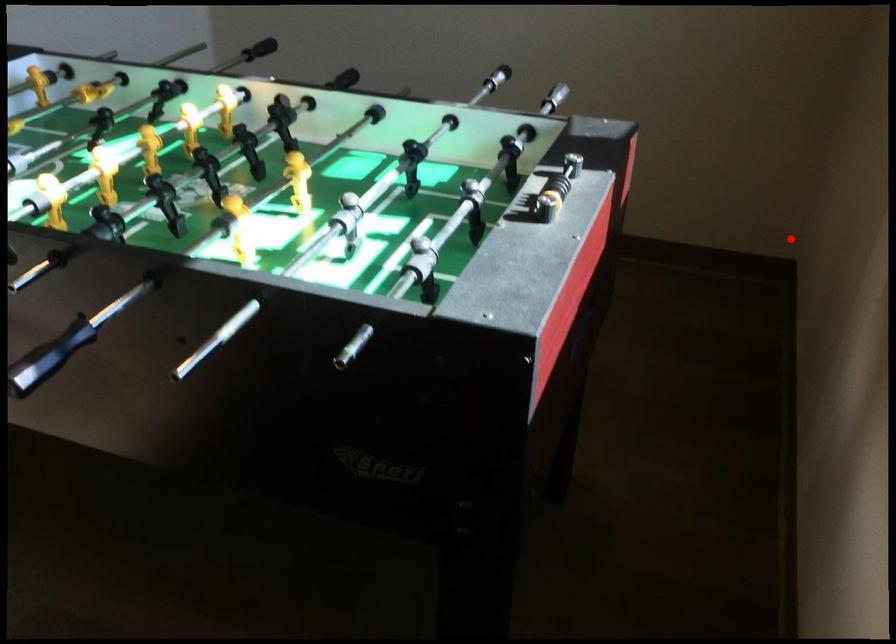
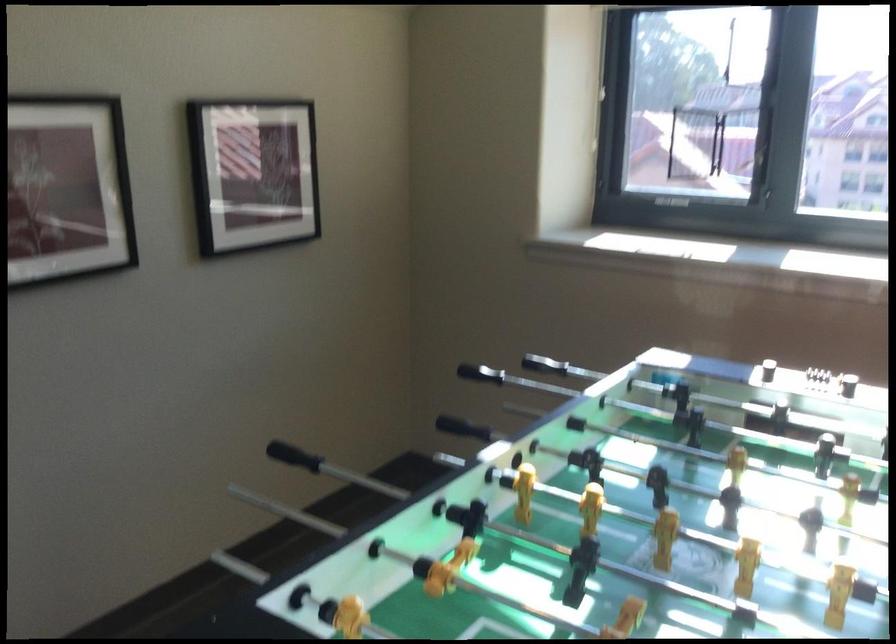
Question: I am providing you with two images of the same scene from different viewpoints. Image1 has a red point marked. In image2, the corresponding 3D location appears at what relative position? Reply with the corresponding letter.

Choices:
 (A) Closer
 (B) Farther

Answer: (B)